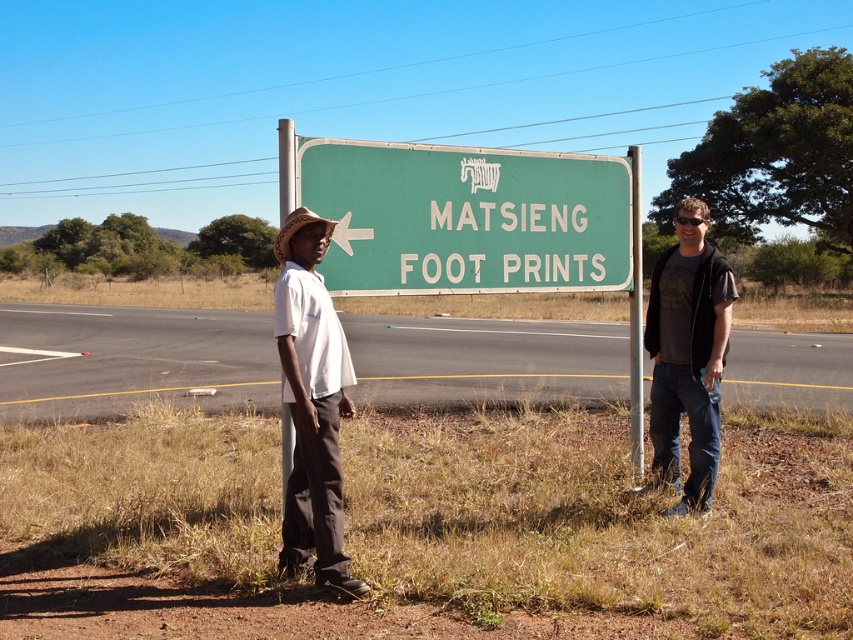
Question: Is green matte sign at center smaller than green painted metal pole at center?

Choices:
 (A) no
 (B) yes

Answer: (B)

Question: Which of the following is the farthest from the observer?

Choices:
 (A) (281, 262)
 (B) (640, 188)
 (C) (294, 470)

Answer: (B)

Question: Which point appears farthest from the camera in this image?

Choices:
 (A) (633, 429)
 (B) (283, 118)
 (C) (714, 358)

Answer: (B)

Question: Which point is farther from the camera taking this photo?

Choices:
 (A) (488, 156)
 (B) (337, 410)
 (C) (279, 154)

Answer: (C)

Question: In this image, where is dark gray t-shirt at right located relative to green painted metal pole at center?

Choices:
 (A) right
 (B) left

Answer: (B)

Question: Is the position of green painted metal pole at center more distant than that of brushed metal pole at left?

Choices:
 (A) yes
 (B) no

Answer: (A)